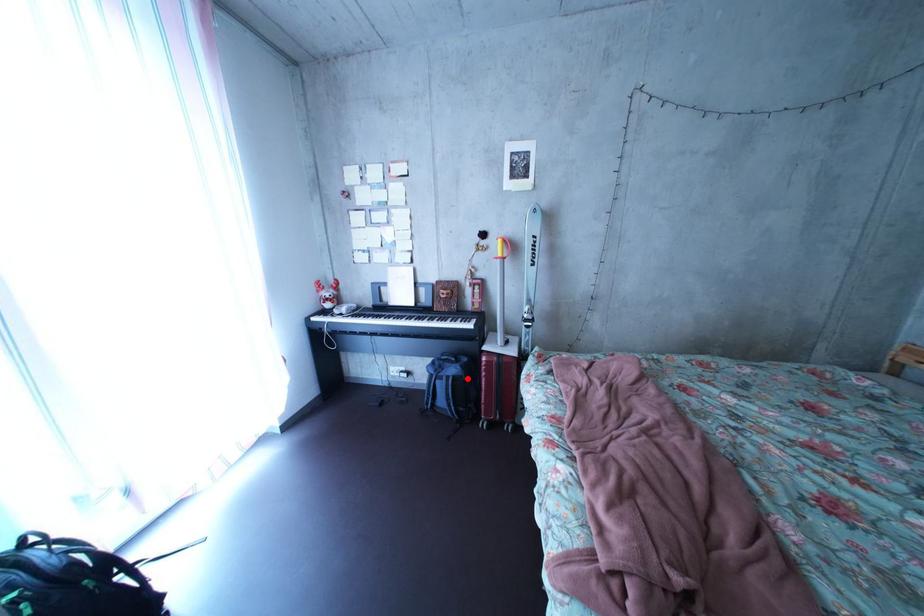
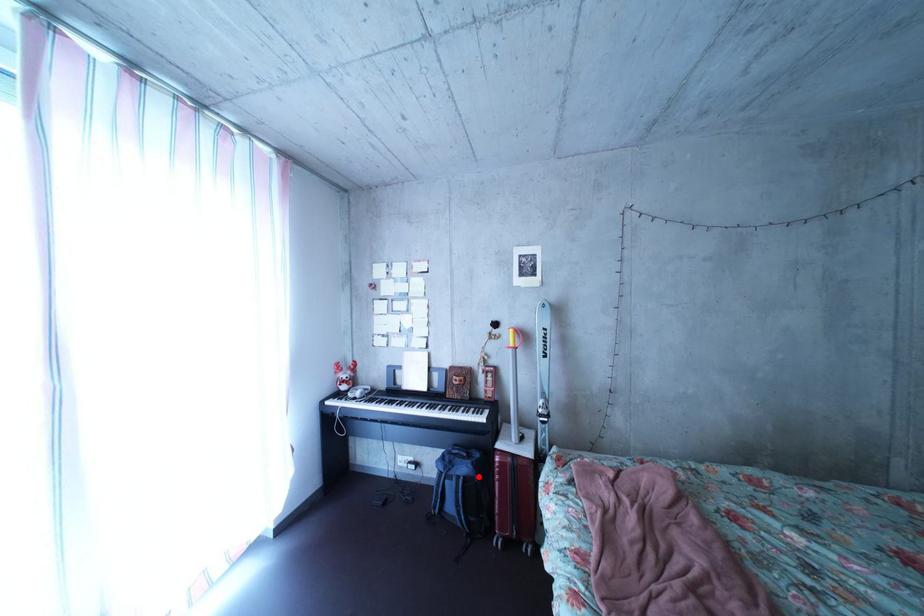
I am providing you with two images of the same scene from different viewpoints. A red point is marked on the first image and another point is marked on the second image. Is the marked point in image1 the same physical position as the marked point in image2?

Yes